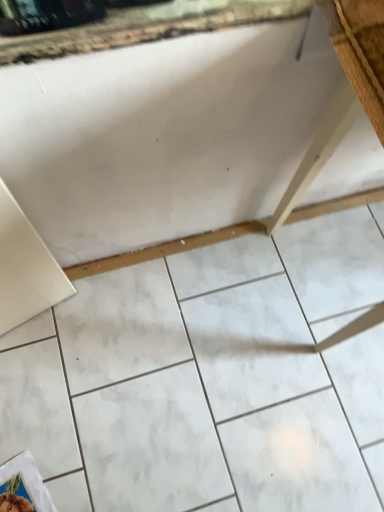
Identify the location of white marble tile at center. (210, 378).

Describe the element at coordinates (210, 378) in the screenshot. I see `white marble tile at center` at that location.

Image resolution: width=384 pixels, height=512 pixels. I want to click on white marble tile at center, so click(210, 378).